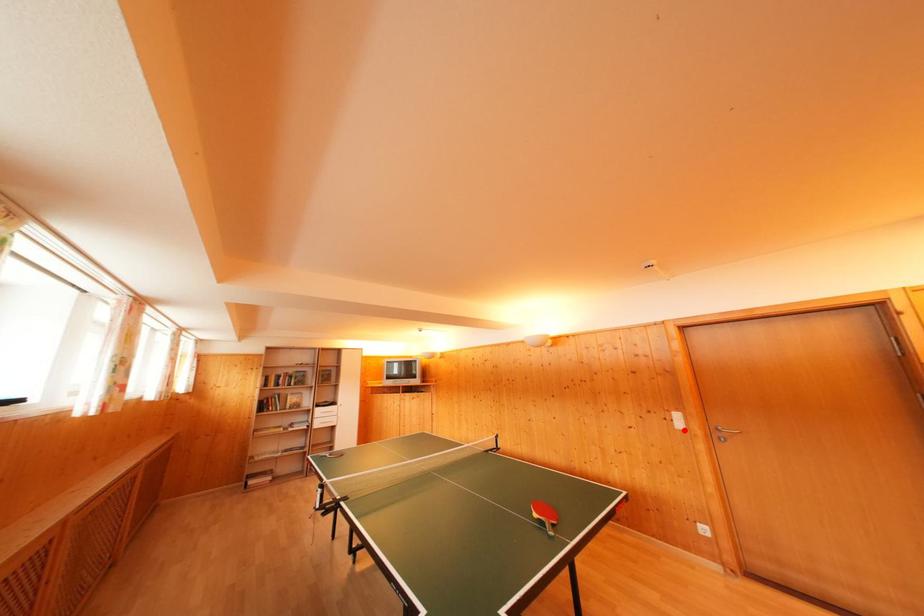
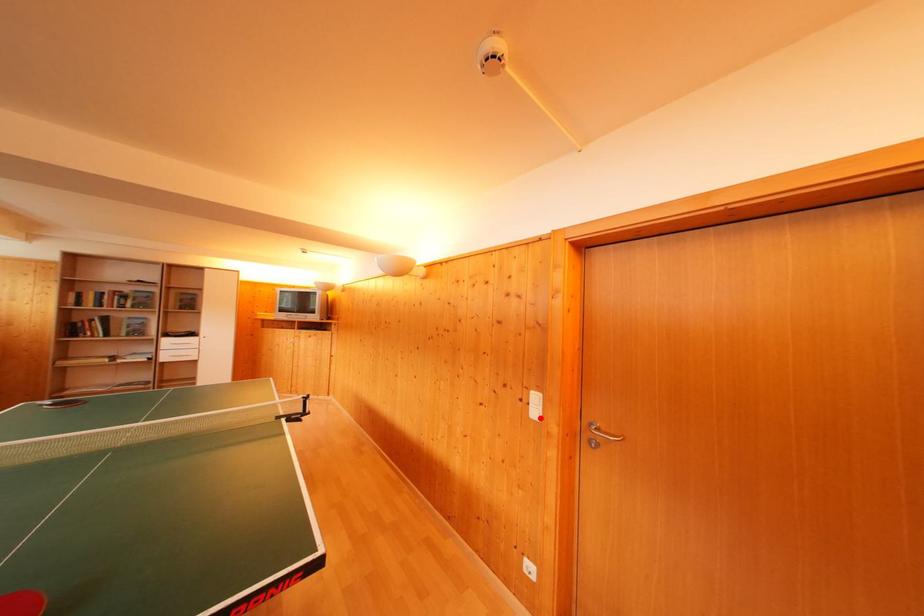
I am providing you with two images of the same scene from different viewpoints. A red point is marked on the first image and another point is marked on the second image. Is the marked point in image1 the same physical position as the marked point in image2?

Yes